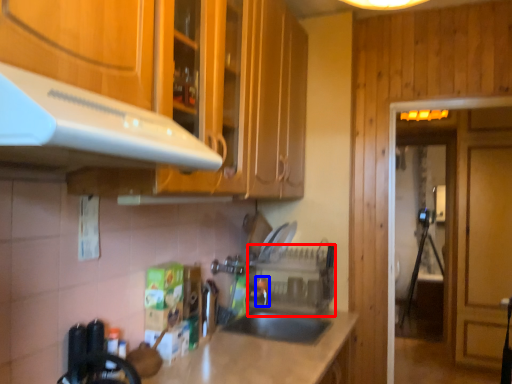
Question: Which object is further to the camera taking this photo, appliance (highlighted by a red box) or faucet (highlighted by a blue box)?

Choices:
 (A) appliance
 (B) faucet

Answer: (B)